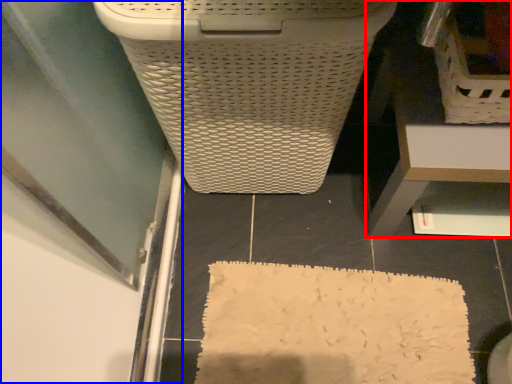
Question: Which point is closer to the camera, furniture (highlighted by a red box) or screen door (highlighted by a blue box)?

Choices:
 (A) furniture
 (B) screen door

Answer: (A)